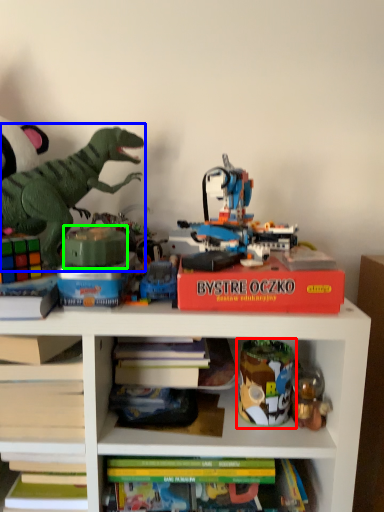
Question: Which object is the farthest from toy (highlighted by a red box)? Choose among these: toy (highlighted by a blue box) or toy (highlighted by a green box).

Choices:
 (A) toy
 (B) toy

Answer: (A)